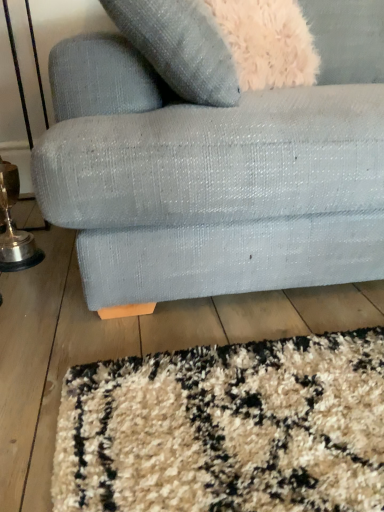
Question: Based on their sizes in the image, would you say textured fabric couch at lower center is bigger or smaller than gold metallic table lamp at lower left?

Choices:
 (A) small
 (B) big

Answer: (B)

Question: Is point (289, 138) closer or farther from the camera than point (3, 163)?

Choices:
 (A) farther
 (B) closer

Answer: (B)

Question: Is textured fabric couch at lower center wider or thinner than gold metallic table lamp at lower left?

Choices:
 (A) wide
 (B) thin

Answer: (A)

Question: From the image's perspective, is gold metallic table lamp at lower left located above or below textured fabric couch at lower center?

Choices:
 (A) above
 (B) below

Answer: (B)

Question: Based on their sizes in the image, would you say gold metallic table lamp at lower left is bigger or smaller than textured fabric couch at lower center?

Choices:
 (A) small
 (B) big

Answer: (A)

Question: From a real-world perspective, is gold metallic table lamp at lower left above or below textured fabric couch at lower center?

Choices:
 (A) below
 (B) above

Answer: (A)

Question: Visually, is gold metallic table lamp at lower left positioned to the left or to the right of textured fabric couch at lower center?

Choices:
 (A) right
 (B) left

Answer: (B)